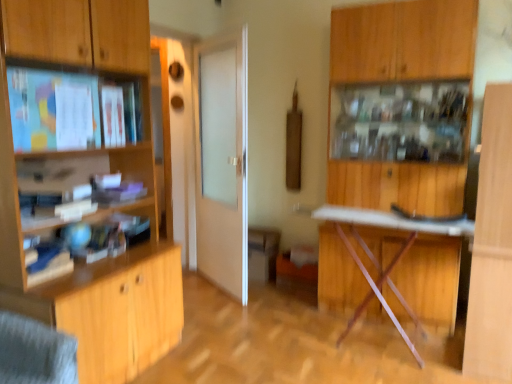
Question: From a real-world perspective, is wooden cabinet at upper right under white frosted glass door at center?

Choices:
 (A) yes
 (B) no

Answer: (B)

Question: Is wooden cabinet at upper right facing towards white frosted glass door at center?

Choices:
 (A) no
 (B) yes

Answer: (A)

Question: Does wooden cabinet at upper right have a smaller size compared to white frosted glass door at center?

Choices:
 (A) no
 (B) yes

Answer: (A)

Question: From the image's perspective, is wooden cabinet at upper right beneath white frosted glass door at center?

Choices:
 (A) yes
 (B) no

Answer: (A)

Question: Can you confirm if wooden cabinet at upper right is taller than white frosted glass door at center?

Choices:
 (A) no
 (B) yes

Answer: (B)

Question: From a real-world perspective, is wooden cabinet at upper right on top of white frosted glass door at center?

Choices:
 (A) no
 (B) yes

Answer: (B)

Question: Is metallic silver table at center not near wooden cabinet at center, the first cabinetry when ordered from right to left?

Choices:
 (A) no
 (B) yes

Answer: (A)

Question: Is wooden cabinet at center, placed as the first cabinetry when sorted from back to front, a part of metallic silver table at center?

Choices:
 (A) yes
 (B) no

Answer: (B)

Question: From a real-world perspective, is metallic silver table at center physically below wooden cabinet at center, which appears as the second cabinetry when viewed from the front?

Choices:
 (A) no
 (B) yes

Answer: (A)

Question: Is metallic silver table at center positioned with its back to wooden cabinet at center, which appears as the second cabinetry when viewed from the front?

Choices:
 (A) yes
 (B) no

Answer: (B)

Question: Is metallic silver table at center touching wooden cabinet at center, placed as the first cabinetry when sorted from back to front?

Choices:
 (A) yes
 (B) no

Answer: (B)

Question: Is metallic silver table at center outside wooden cabinet at center, the first cabinetry when ordered from right to left?

Choices:
 (A) yes
 (B) no

Answer: (A)

Question: Is wooden cabinet at left, which is the first cabinetry from left to right, oriented away from wooden cabinet at center, acting as the second cabinetry starting from the left?

Choices:
 (A) yes
 (B) no

Answer: (B)